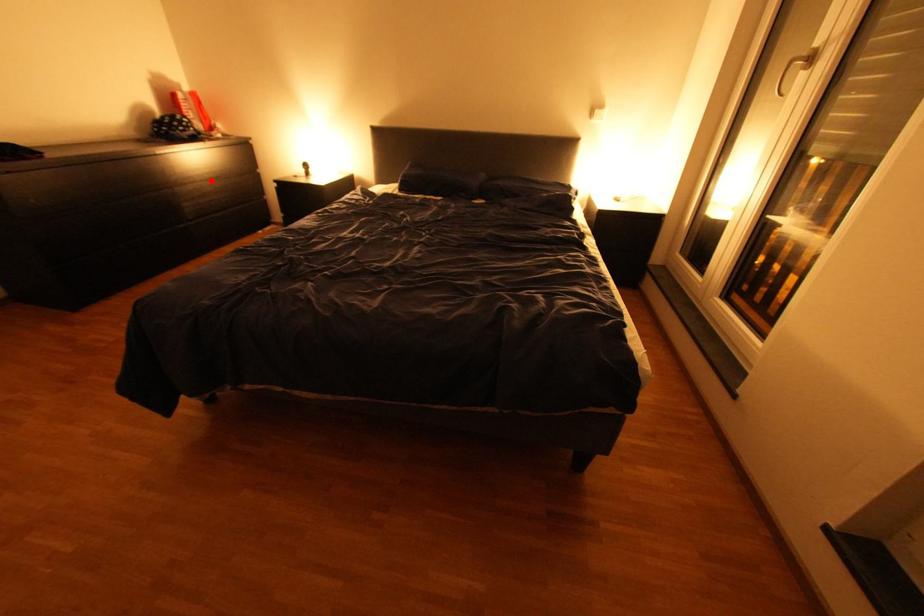
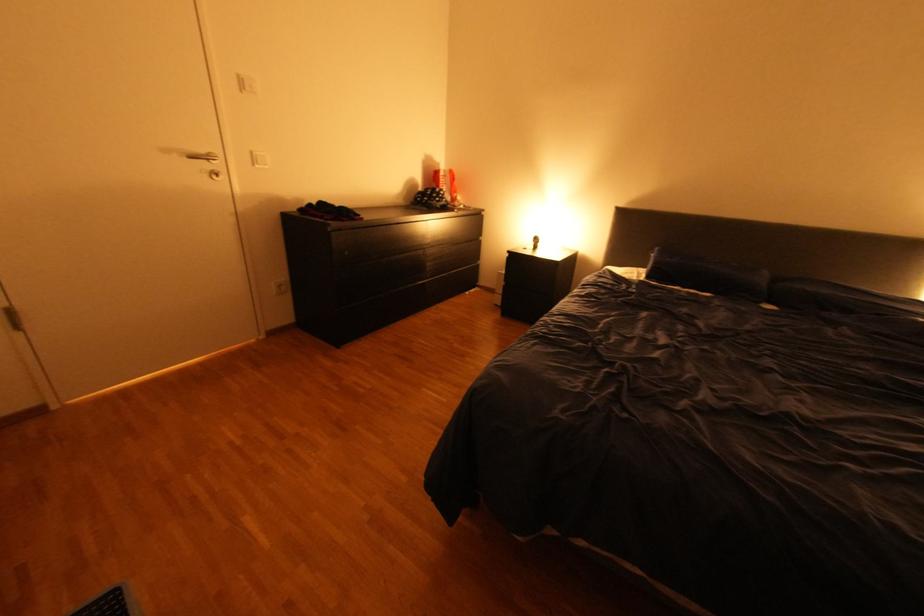
Question: A red point is marked in image1. In image2, is the corresponding 3D point closer to the camera or farther? Reply with the corresponding letter.

Choices:
 (A) The corresponding 3D point is closer.
 (B) The corresponding 3D point is farther.

Answer: (A)